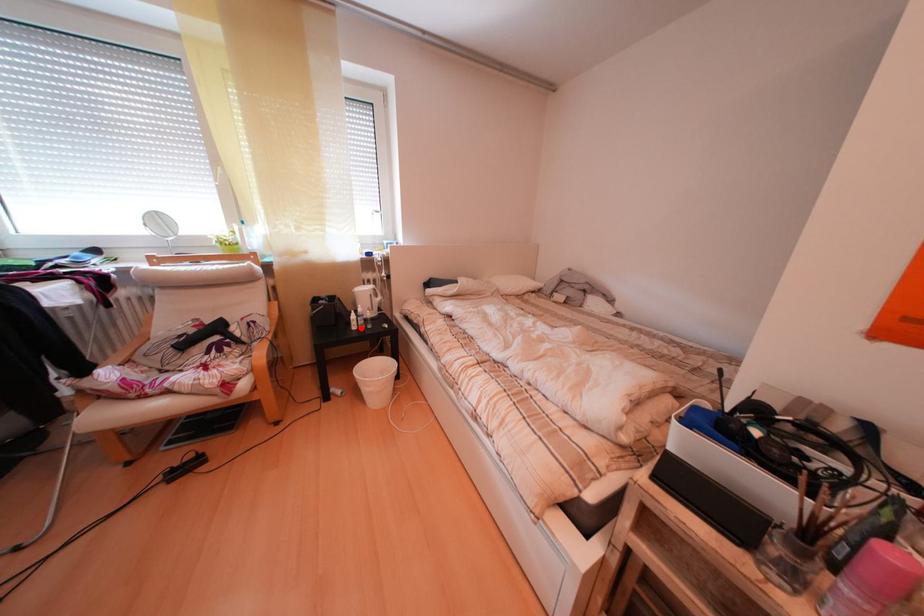
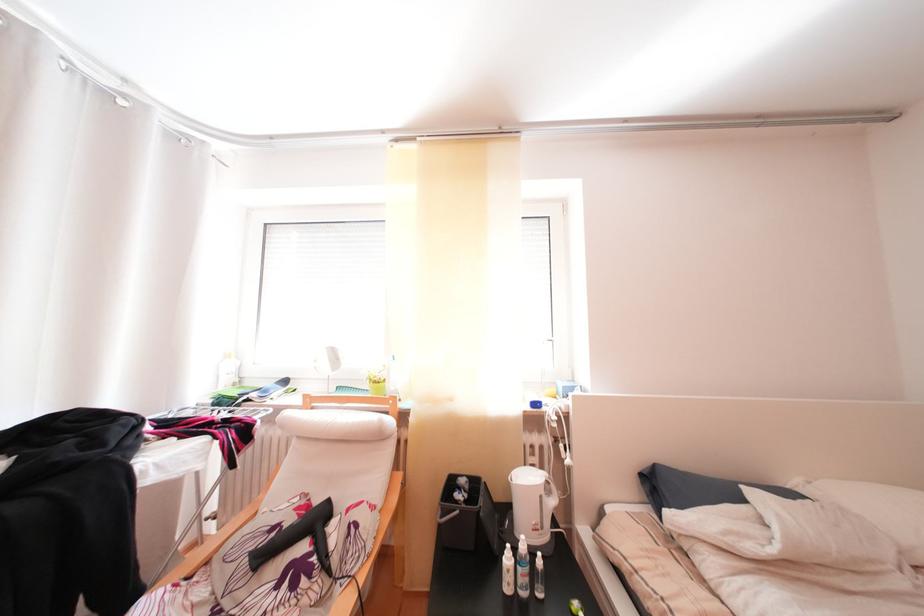
Locate, in the second image, the point that corresponds to the highlighted location in the first image.

(509, 565)